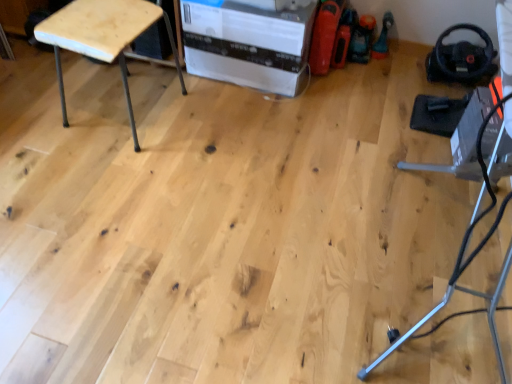
Question: Based on their positions, is white cardboard box at center located to the left or right of natural wood stool at upper left?

Choices:
 (A) right
 (B) left

Answer: (A)

Question: From the image's perspective, is white cardboard box at center positioned above or below natural wood stool at upper left?

Choices:
 (A) above
 (B) below

Answer: (A)

Question: Do you think white cardboard box at center is within natural wood stool at upper left, or outside of it?

Choices:
 (A) outside
 (B) inside

Answer: (A)

Question: From the image's perspective, is natural wood stool at upper left located above or below white cardboard box at center?

Choices:
 (A) above
 (B) below

Answer: (B)

Question: Would you say natural wood stool at upper left is to the left or to the right of white cardboard box at center in the picture?

Choices:
 (A) left
 (B) right

Answer: (A)

Question: Is natural wood stool at upper left inside or outside of white cardboard box at center?

Choices:
 (A) inside
 (B) outside

Answer: (B)

Question: Considering the positions of natural wood stool at upper left and white cardboard box at center in the image, is natural wood stool at upper left wider or thinner than white cardboard box at center?

Choices:
 (A) thin
 (B) wide

Answer: (A)